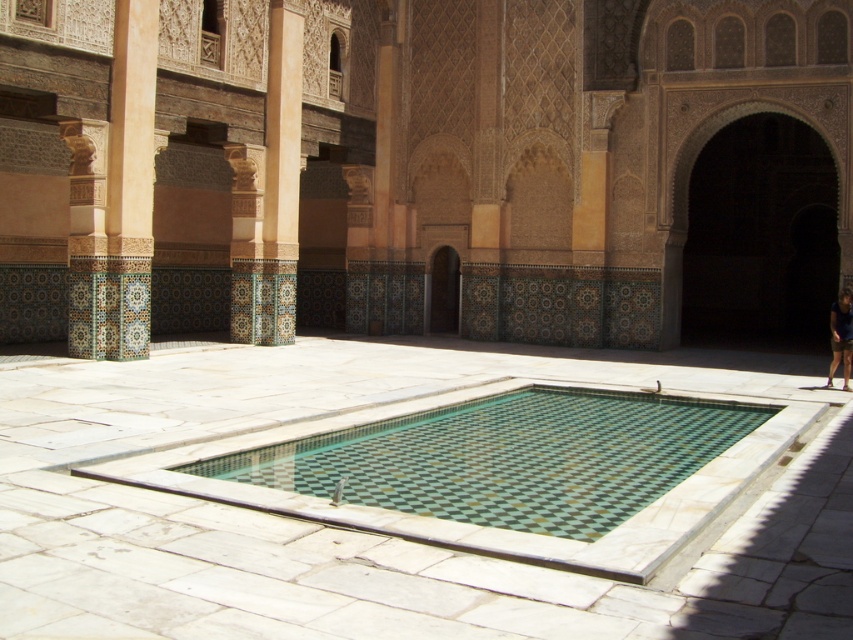
Is point (544, 532) in front of point (834, 333)?

Yes, point (544, 532) is closer to viewer.

Is green mosaic tile swimming pool at center closer to the viewer compared to dark blue fabric at lower right?

Yes, it is.

Which is behind, point (677, 428) or point (840, 289)?

The point (840, 289) is behind.

Where is `green mosaic tile swimming pool at center`? green mosaic tile swimming pool at center is located at coordinates (508, 458).

Which is behind, point (606, 458) or point (663, 346)?

Point (663, 346)

The height and width of the screenshot is (640, 853). What are the coordinates of `green mosaic tile swimming pool at center` in the screenshot? It's located at (508, 458).

What do you see at coordinates (508, 458) in the screenshot? This screenshot has height=640, width=853. I see `green mosaic tile swimming pool at center` at bounding box center [508, 458].

Image resolution: width=853 pixels, height=640 pixels. Identify the location of green mosaic tile swimming pool at center. (508, 458).

Can you confirm if green mosaic pool at center is shorter than dark stone archway at center?

No.

Does green mosaic pool at center appear on the left side of dark stone archway at center?

Yes, green mosaic pool at center is to the left of dark stone archway at center.

Is point (445, 609) more distant than point (660, 296)?

No.

In order to click on green mosaic pool at center in this screenshot , I will do `click(367, 532)`.